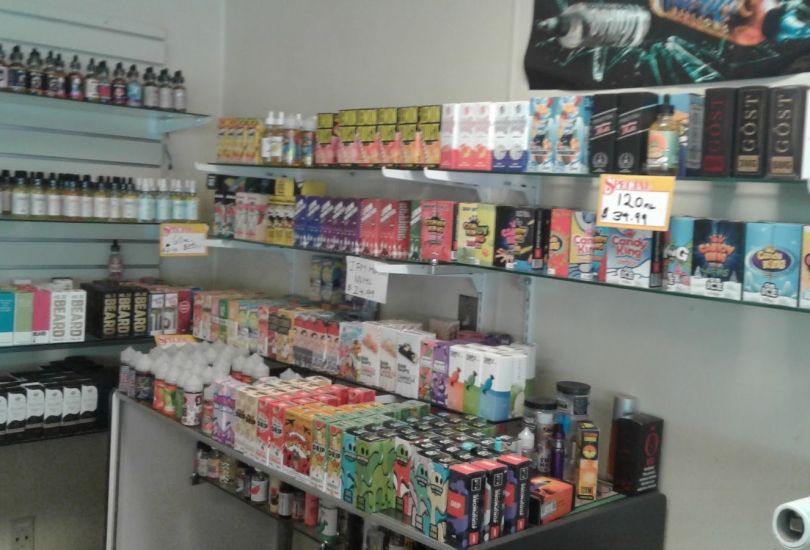
Identify the location of wall. Image resolution: width=810 pixels, height=550 pixels. (714, 372), (388, 42), (198, 40), (75, 469).